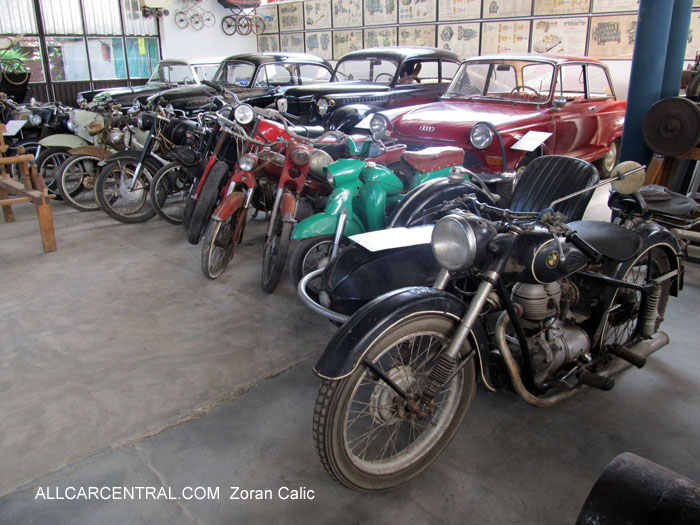
Locate an element on the screen. Image resolution: width=700 pixels, height=525 pixels. seat is located at coordinates (554, 192), (663, 195), (433, 160), (349, 136), (309, 130), (119, 122), (330, 140), (218, 106), (536, 94), (273, 80).